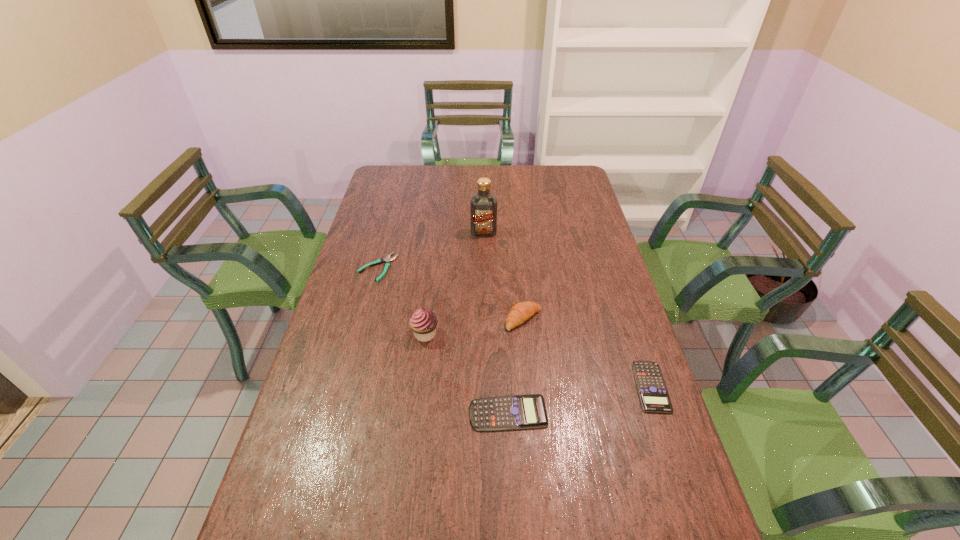
Locate an element on the screen. Image resolution: width=960 pixels, height=540 pixels. vacant area in the image that satisfies the following two spatial constraints: 1. on the front-facing side of the farthest object; 2. on the right side of the crescent roll is located at coordinates (485, 319).

Find the location of `free space that satisfies the following two spatial constraints: 1. on the back side of the fourth shortest object; 2. on the left side of the fifth object from right to left`. free space that satisfies the following two spatial constraints: 1. on the back side of the fourth shortest object; 2. on the left side of the fifth object from right to left is located at coordinates (427, 319).

What are the coordinates of `vacant point that satisfies the following two spatial constraints: 1. on the front-facing side of the tallest object; 2. on the right side of the left calculator` in the screenshot? It's located at (486, 413).

Where is `free space that satisfies the following two spatial constraints: 1. on the front-facing side of the rightmost object; 2. on the right side of the farthest object`? free space that satisfies the following two spatial constraints: 1. on the front-facing side of the rightmost object; 2. on the right side of the farthest object is located at coordinates (485, 387).